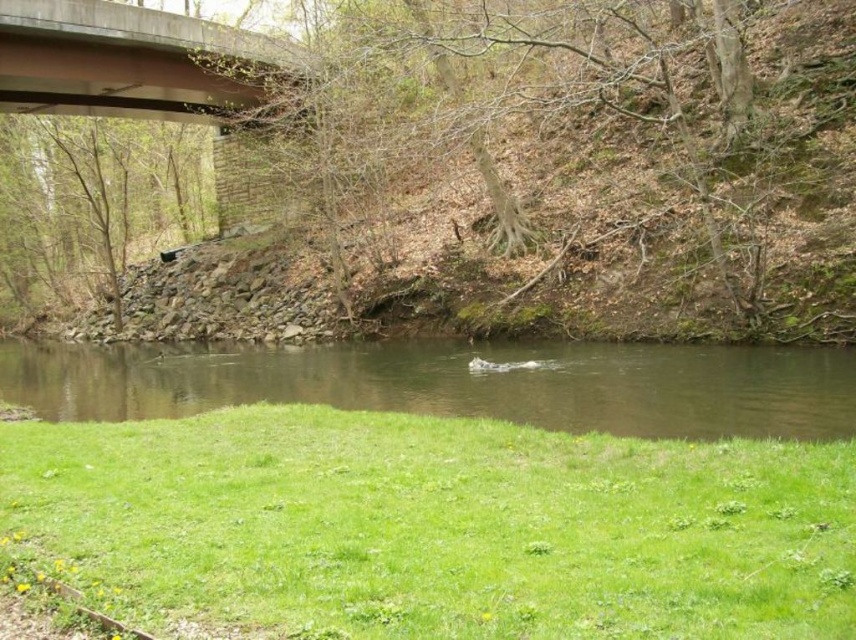
Does green grass at lower center appear over concrete at upper center?

No, green grass at lower center is not above concrete at upper center.

Identify the location of green grass at lower center. (438, 525).

Is point (465, 512) closer to camera compared to point (207, 38)?

Yes, it is in front of point (207, 38).

The image size is (856, 640). In order to click on green grass at lower center in this screenshot , I will do `click(438, 525)`.

Can you confirm if brown murky water at center is smaller than concrete at upper center?

Actually, brown murky water at center might be larger than concrete at upper center.

Which is below, brown murky water at center or concrete at upper center?

brown murky water at center is lower down.

Locate an element on the screen. brown murky water at center is located at coordinates (455, 384).

Does point (292, 451) lie in front of point (354, 384)?

Yes.

Is green grass at lower center closer to camera compared to brown murky water at center?

Yes.

Does point (366, 605) lie behind point (425, 381)?

No.

Where is `green grass at lower center`? The height and width of the screenshot is (640, 856). green grass at lower center is located at coordinates 438,525.